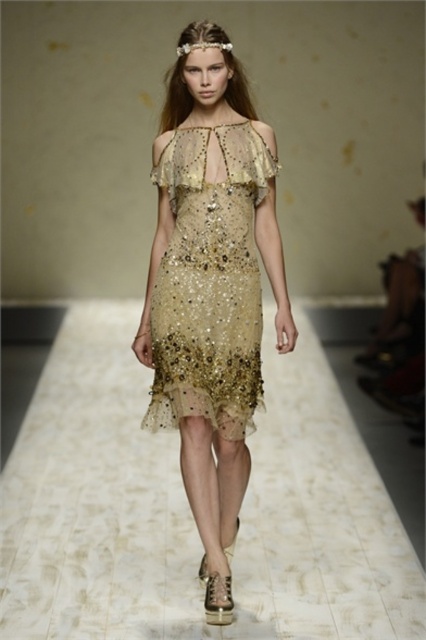
You are a photographer at the runway show and need to capture the model wearing both the gold sequined dress at center and the shimmering sequined dress at center in a single frame. Which dress should you adjust your camera angle to focus on first to ensure both are visible?

The gold sequined dress at center is wider than the shimmering sequined dress at center, so you should focus on the gold sequined dress at center first to accommodate its larger width in the frame.

In the scene shown: You are a photographer at the runway show and need to capture a clear shot of both the gold sequined dress at center and the shimmering sequined dress at center. Since the dresses are positioned close to each other, will adjusting the camera angle allow you to focus on both dresses without one blocking the other?

The gold sequined dress at center is positioned under the shimmering sequined dress at center, so adjusting the camera angle downward might allow you to capture both dresses without one blocking the other.

You are a photographer positioned at the front of the runway. You want to capture a photo that includes both the point at (227, 502) and the point at (190, 148). Based on their positions, which point should be placed closer to the background in your composition?

Point (227, 502) is behind point (190, 148), so in the composition, point (227, 502) should be closer to the background.